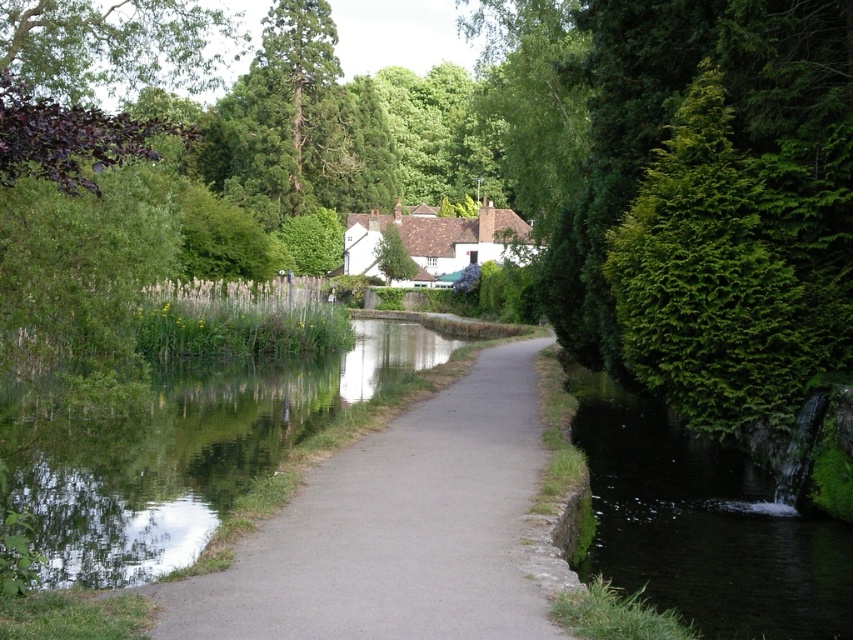
You are a gardener planning to trim the green textured hedge at right and the white matte cottage at center. Since you have limited time, which object should you prioritize trimming first based on their widths?

The green textured hedge at right has a lesser width compared to the white matte cottage at center, so you should prioritize trimming the white matte cottage at center first as it is wider and may require more time.

You are standing at the center of the paved pathway in the rural scene. You want to reach the green textured hedge at right. Which direction should you walk to get closer to it?

You should walk to the right to get closer to the green textured hedge at right since it is located at the right side of the scene.